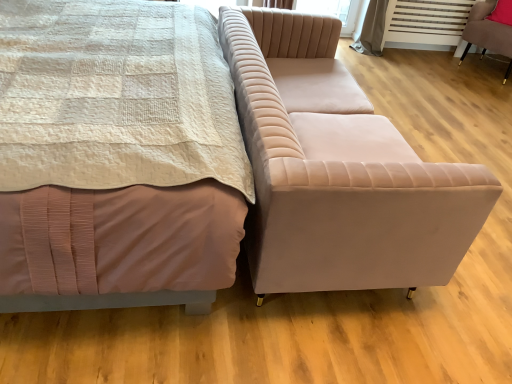
The image size is (512, 384). Describe the element at coordinates (117, 157) in the screenshot. I see `matte pink bed at center` at that location.

Where is `velvet beige couch at center`? velvet beige couch at center is located at coordinates (338, 183).

Find the location of a particular element. This screenshot has height=384, width=512. matte pink bed at center is located at coordinates (117, 157).

Between point (400, 215) and point (487, 1), which one is positioned in front?

Point (400, 215)

Can you confirm if velvet beige couch at center is positioned to the right of velvet pink chair at right?

No, velvet beige couch at center is not to the right of velvet pink chair at right.

From the image's perspective, which object appears higher, velvet beige couch at center or velvet pink chair at right?

velvet pink chair at right is shown above in the image.

From a real-world perspective, who is located higher, velvet beige couch at center or velvet pink chair at right?

In real-world perspective, velvet beige couch at center is above.

Could you tell me if velvet pink chair at right is turned towards velvet beige couch at center?

Yes.

From the image's perspective, does velvet pink chair at right appear higher than velvet beige couch at center?

Indeed, from the image's perspective, velvet pink chair at right is shown above velvet beige couch at center.

Is velvet pink chair at right positioned in front of velvet beige couch at center?

No, velvet pink chair at right is behind velvet beige couch at center.

Find the location of a particular element. This screenshot has height=384, width=512. studio couch lying in front of the velvet pink chair at right is located at coordinates (338, 183).

Is velvet beige couch at center facing away from matte pink bed at center?

Yes, matte pink bed at center is at the back of velvet beige couch at center.

Is velvet beige couch at center smaller than matte pink bed at center?

Indeed, velvet beige couch at center has a smaller size compared to matte pink bed at center.

From the image's perspective, is velvet beige couch at center below matte pink bed at center?

Indeed, from the image's perspective, velvet beige couch at center is shown beneath matte pink bed at center.

Is point (436, 188) farther from viewer compared to point (105, 82)?

No.

Which object is positioned more to the right, pink fabric pillow at upper right or matte pink bed at center?

From the viewer's perspective, pink fabric pillow at upper right appears more on the right side.

Is matte pink bed at center surrounded by pink fabric pillow at upper right?

Definitely not — matte pink bed at center is not inside pink fabric pillow at upper right.

From the image's perspective, which one is positioned lower, pink fabric pillow at upper right or matte pink bed at center?

matte pink bed at center, from the image's perspective.

Does pink fabric pillow at upper right come behind matte pink bed at center?

Yes, it is.

Between pink fabric pillow at upper right and velvet pink chair at right, which one has larger width?

Wider between the two is velvet pink chair at right.

Between pink fabric pillow at upper right and velvet pink chair at right, which one appears on the right side from the viewer's perspective?

Positioned to the right is velvet pink chair at right.

Would you consider pink fabric pillow at upper right to be distant from velvet pink chair at right?

Actually, pink fabric pillow at upper right and velvet pink chair at right are a little close together.

Considering the positions of point (495, 18) and point (505, 26), is point (495, 18) closer or farther from the camera than point (505, 26)?

Point (495, 18) is positioned farther from the camera compared to point (505, 26).

Does velvet beige couch at center contain pink fabric pillow at upper right?

No, pink fabric pillow at upper right is not inside velvet beige couch at center.

Consider the image. Which object is closer to the camera, velvet beige couch at center or pink fabric pillow at upper right?

Positioned in front is velvet beige couch at center.

Could you tell me if velvet beige couch at center is turned towards pink fabric pillow at upper right?

Yes, velvet beige couch at center faces towards pink fabric pillow at upper right.

From the image's perspective, is velvet beige couch at center located beneath pink fabric pillow at upper right?

Yes, from the image's perspective, velvet beige couch at center is below pink fabric pillow at upper right.

Is matte pink bed at center positioned beyond the bounds of pink fabric pillow at upper right?

Indeed, matte pink bed at center is completely outside pink fabric pillow at upper right.

Find the location of a particular element. This screenshot has width=512, height=384. pillow on the right of matte pink bed at center is located at coordinates (502, 12).

Which of these two, matte pink bed at center or pink fabric pillow at upper right, is wider?

matte pink bed at center.

The width and height of the screenshot is (512, 384). I want to click on chair above the velvet beige couch at center (from the image's perspective), so click(487, 33).

The height and width of the screenshot is (384, 512). Find the location of `studio couch below the velvet pink chair at right (from the image's perspective)`. studio couch below the velvet pink chair at right (from the image's perspective) is located at coordinates (338, 183).

Considering their positions, is velvet beige couch at center positioned further to matte pink bed at center than velvet pink chair at right?

Based on the image, velvet pink chair at right appears to be further to matte pink bed at center.

Which object lies nearer to the anchor point velvet pink chair at right, pink fabric pillow at upper right or matte pink bed at center?

pink fabric pillow at upper right is closer to velvet pink chair at right.

Which object lies nearer to the anchor point velvet beige couch at center, matte pink bed at center or pink fabric pillow at upper right?

matte pink bed at center lies closer to velvet beige couch at center than the other object.

Based on their spatial positions, is velvet beige couch at center or matte pink bed at center further from velvet pink chair at right?

matte pink bed at center.

Which object lies further to the anchor point velvet pink chair at right, velvet beige couch at center or pink fabric pillow at upper right?

velvet beige couch at center is further to velvet pink chair at right.

Looking at the image, which one is located further to velvet pink chair at right, matte pink bed at center or pink fabric pillow at upper right?

matte pink bed at center.

Which object lies nearer to the anchor point pink fabric pillow at upper right, velvet pink chair at right or velvet beige couch at center?

velvet pink chair at right.

From the image, which object appears to be farther from velvet beige couch at center, matte pink bed at center or velvet pink chair at right?

velvet pink chair at right.

At what (x,y) coordinates should I click in order to perform the action: click on chair between velvet beige couch at center and pink fabric pillow at upper right in the front-back direction. Please return your answer as a coordinate pair (x, y). This screenshot has width=512, height=384. Looking at the image, I should click on (487, 33).

The image size is (512, 384). Find the location of `studio couch between matte pink bed at center and velvet pink chair at right`. studio couch between matte pink bed at center and velvet pink chair at right is located at coordinates (338, 183).

At what (x,y) coordinates should I click in order to perform the action: click on pillow located between matte pink bed at center and velvet pink chair at right in the left-right direction. Please return your answer as a coordinate pair (x, y). Image resolution: width=512 pixels, height=384 pixels. Looking at the image, I should click on coord(502,12).

I want to click on studio couch between matte pink bed at center and pink fabric pillow at upper right in the front-back direction, so click(x=338, y=183).